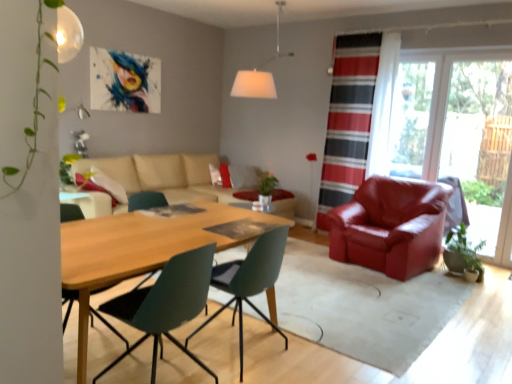
Question: Is transparent glass door at right closer to the viewer compared to satin red armchair at right, placed as the first chair when sorted from right to left?

Choices:
 (A) no
 (B) yes

Answer: (A)

Question: Does transparent glass door at right have a lesser width compared to satin red armchair at right, the 3th chair positioned from the left?

Choices:
 (A) yes
 (B) no

Answer: (A)

Question: Does transparent glass door at right have a smaller size compared to satin red armchair at right, which is the 3th chair from front to back?

Choices:
 (A) yes
 (B) no

Answer: (A)

Question: From the image's perspective, does transparent glass door at right appear higher than satin red armchair at right, placed as the first chair when sorted from right to left?

Choices:
 (A) yes
 (B) no

Answer: (A)

Question: Is transparent glass door at right positioned beyond the bounds of satin red armchair at right, the 3th chair positioned from the left?

Choices:
 (A) no
 (B) yes

Answer: (B)

Question: From a real-world perspective, is transparent glass door at right physically below satin red armchair at right, the 3th chair positioned from the left?

Choices:
 (A) yes
 (B) no

Answer: (B)

Question: Can you confirm if striped fabric curtain at right is shorter than beige fabric couch at center?

Choices:
 (A) yes
 (B) no

Answer: (B)

Question: Is striped fabric curtain at right placed right next to beige fabric couch at center?

Choices:
 (A) no
 (B) yes

Answer: (A)

Question: Can you confirm if striped fabric curtain at right is wider than beige fabric couch at center?

Choices:
 (A) no
 (B) yes

Answer: (A)

Question: Is striped fabric curtain at right facing towards beige fabric couch at center?

Choices:
 (A) no
 (B) yes

Answer: (A)

Question: Is striped fabric curtain at right behind beige fabric couch at center?

Choices:
 (A) yes
 (B) no

Answer: (A)

Question: Is striped fabric curtain at right far away from beige fabric couch at center?

Choices:
 (A) no
 (B) yes

Answer: (B)

Question: Considering the relative positions of white fabric lampshade at upper center and beige fabric couch at center in the image provided, is white fabric lampshade at upper center to the right of beige fabric couch at center from the viewer's perspective?

Choices:
 (A) yes
 (B) no

Answer: (A)